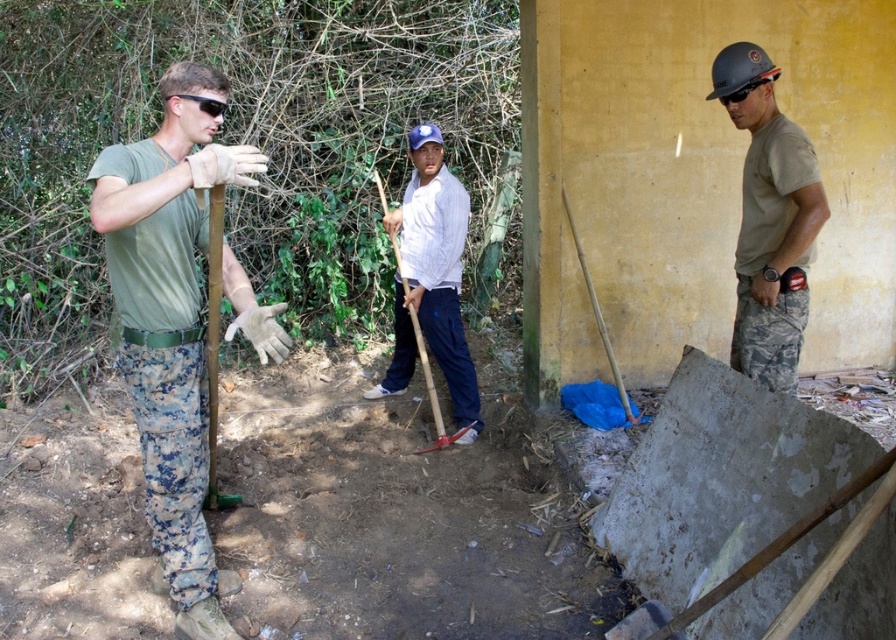
Question: Which object appears closest to the camera in this image?

Choices:
 (A) camouflage pants at right
 (B) smooth concrete slab at lower right

Answer: (B)

Question: Which object is closer to the camera taking this photo?

Choices:
 (A) camouflage pants at right
 (B) green wood shovel at left

Answer: (B)

Question: Can you confirm if camouflage pants at right is wider than green wood shovel at left?

Choices:
 (A) no
 (B) yes

Answer: (A)

Question: Which point appears closest to the camera in this image?

Choices:
 (A) (757, 637)
 (B) (428, 394)

Answer: (A)

Question: Is camouflage pants at center closer to camera compared to green wood shovel at left?

Choices:
 (A) no
 (B) yes

Answer: (B)

Question: Observing the image, what is the correct spatial positioning of camouflage pants at center in reference to camouflage pants at right?

Choices:
 (A) below
 (B) above

Answer: (A)